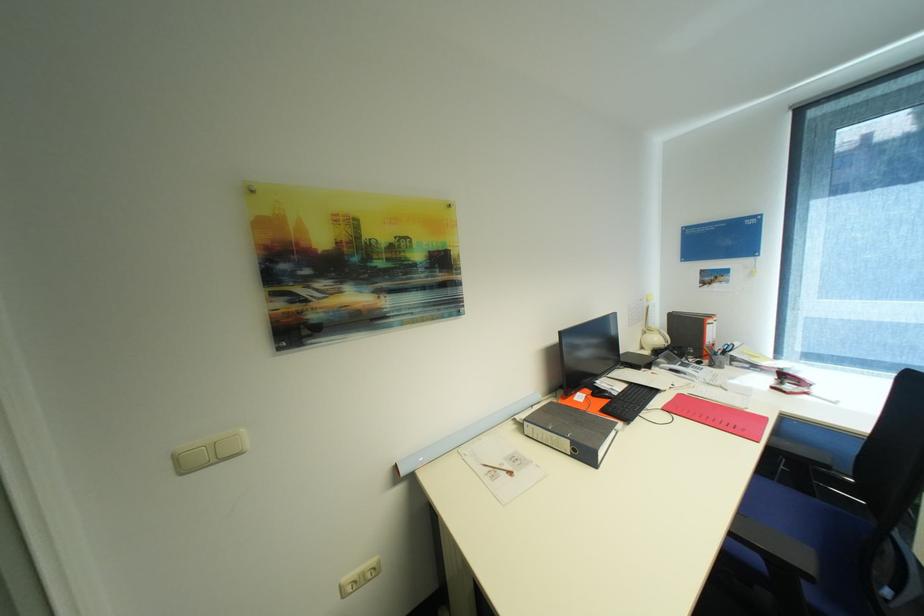
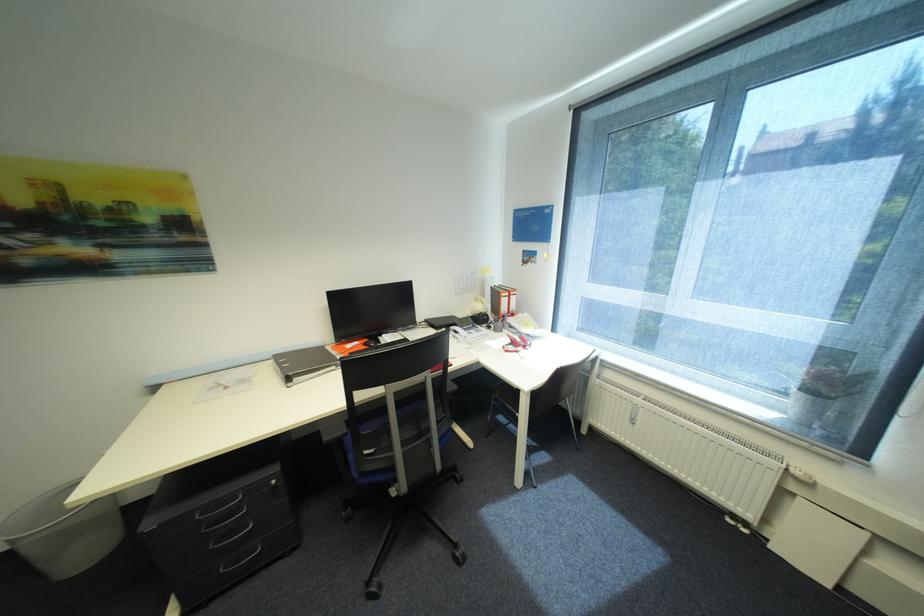
The point at (723, 285) is marked in the first image. Where is the corresponding point in the second image?

(537, 265)